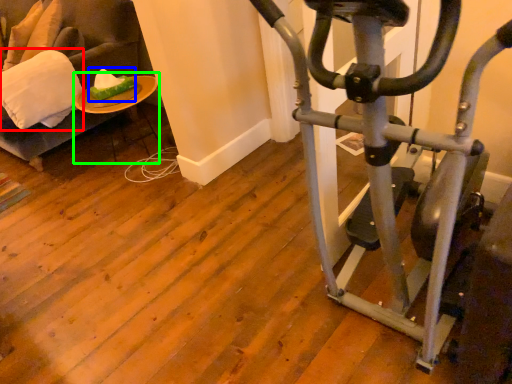
Question: Based on their relative distances, which object is farther from pillow (highlighted by a red box)? Choose from food (highlighted by a blue box) and table (highlighted by a green box).

Choices:
 (A) food
 (B) table

Answer: (A)